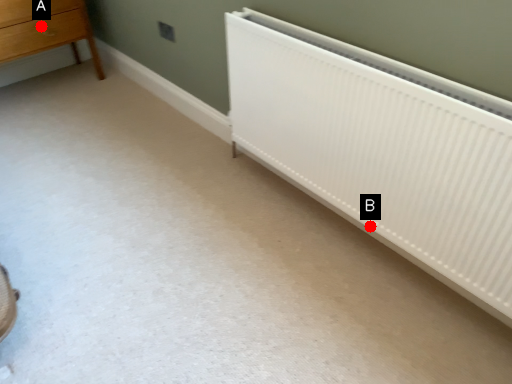
Question: Two points are circled on the image, labeled by A and B beside each circle. Which of the following is the farthest from the observer?

Choices:
 (A) A is further
 (B) B is further

Answer: (A)